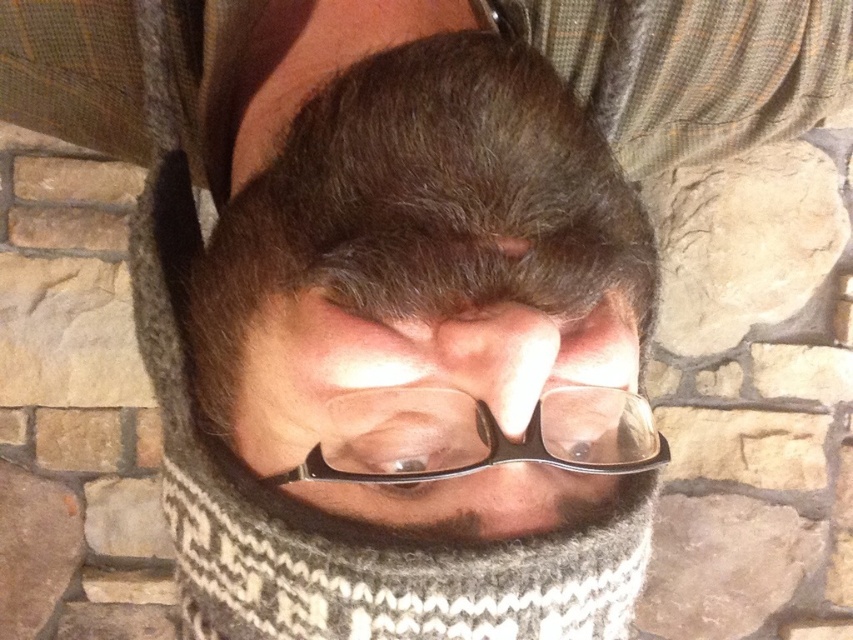
Which of these two, matte black glasses at center or transparent plastic glasses at center, stands taller?

Standing taller between the two is matte black glasses at center.

Can you confirm if matte black glasses at center is positioned to the left of transparent plastic glasses at center?

Indeed, matte black glasses at center is positioned on the left side of transparent plastic glasses at center.

Find the location of `matte black glasses at center`. matte black glasses at center is located at coordinates (433, 300).

Find the location of `matte black glasses at center`. matte black glasses at center is located at coordinates (433, 300).